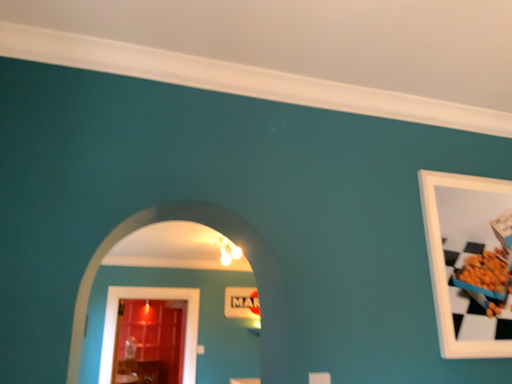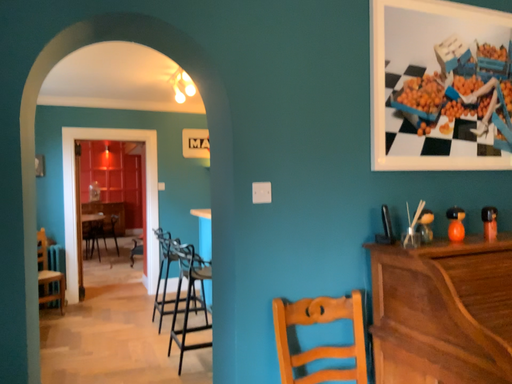
Question: Which way did the camera rotate in the video?

Choices:
 (A) rotated upward
 (B) rotated downward

Answer: (B)